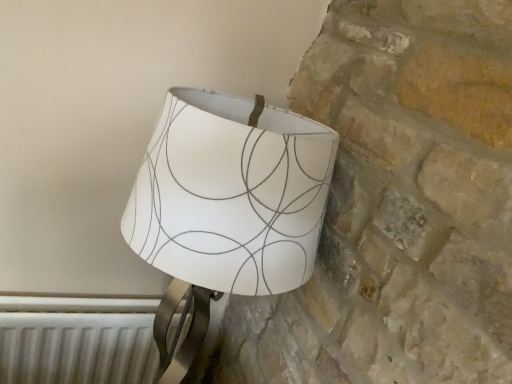
Question: From a real-world perspective, is white paper lampshade at upper right over white metallic radiator at lower left?

Choices:
 (A) no
 (B) yes

Answer: (B)

Question: Considering the relative positions of white paper lampshade at upper right and white metallic radiator at lower left in the image provided, is white paper lampshade at upper right behind white metallic radiator at lower left?

Choices:
 (A) yes
 (B) no

Answer: (B)

Question: Is white paper lampshade at upper right located outside white metallic radiator at lower left?

Choices:
 (A) no
 (B) yes

Answer: (B)

Question: From the image's perspective, is white paper lampshade at upper right under white metallic radiator at lower left?

Choices:
 (A) yes
 (B) no

Answer: (B)

Question: Is white paper lampshade at upper right wider than white metallic radiator at lower left?

Choices:
 (A) no
 (B) yes

Answer: (B)

Question: Does white paper lampshade at upper right touch white metallic radiator at lower left?

Choices:
 (A) no
 (B) yes

Answer: (A)

Question: Can you confirm if white metallic radiator at lower left is taller than white paper lampshade at upper right?

Choices:
 (A) no
 (B) yes

Answer: (A)

Question: Considering the relative sizes of white metallic radiator at lower left and white paper lampshade at upper right in the image provided, is white metallic radiator at lower left shorter than white paper lampshade at upper right?

Choices:
 (A) no
 (B) yes

Answer: (B)

Question: Is white metallic radiator at lower left closer to the viewer compared to white paper lampshade at upper right?

Choices:
 (A) no
 (B) yes

Answer: (A)

Question: Is the depth of white metallic radiator at lower left greater than that of white paper lampshade at upper right?

Choices:
 (A) yes
 (B) no

Answer: (A)

Question: Is white metallic radiator at lower left not near white paper lampshade at upper right?

Choices:
 (A) yes
 (B) no

Answer: (B)

Question: Does white metallic radiator at lower left appear on the left side of white paper lampshade at upper right?

Choices:
 (A) no
 (B) yes

Answer: (B)

Question: From a real-world perspective, is white metallic radiator at lower left above or below white paper lampshade at upper right?

Choices:
 (A) above
 (B) below

Answer: (B)